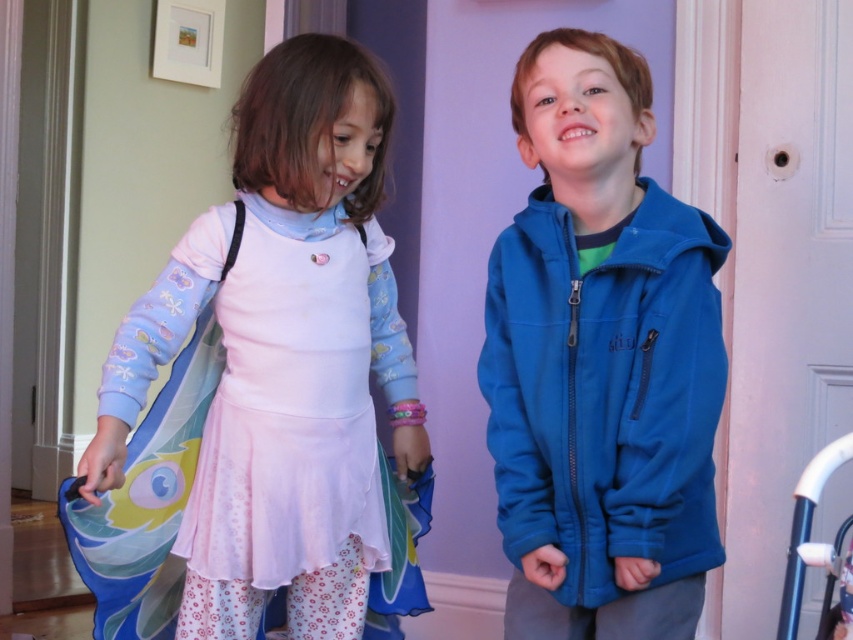
Question: Does pastel pink fabric dress at center come in front of blue fleece jacket at center?

Choices:
 (A) no
 (B) yes

Answer: (A)

Question: Which of the following is the farthest from the observer?

Choices:
 (A) (589, 474)
 (B) (303, 412)

Answer: (B)

Question: Is pastel pink fabric dress at center wider than blue fleece jacket at center?

Choices:
 (A) yes
 (B) no

Answer: (A)

Question: Does pastel pink fabric dress at center lie behind blue fleece jacket at center?

Choices:
 (A) yes
 (B) no

Answer: (A)

Question: Which point is closer to the camera?

Choices:
 (A) pastel pink fabric dress at center
 (B) blue fleece jacket at center

Answer: (B)